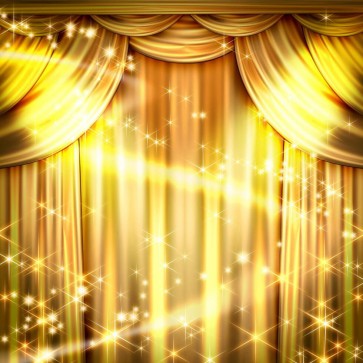
Identify the location of center valence. This screenshot has width=363, height=363. (200, 47).